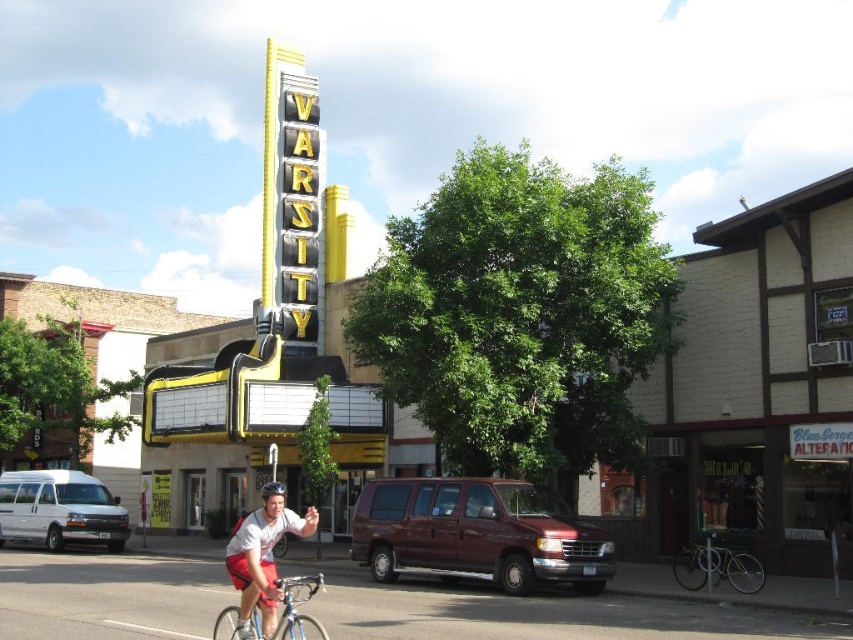
Is matte white helmet at center positioned before silver metallic bicycle at lower left?

No, matte white helmet at center is further to the viewer.

Who is higher up, matte white helmet at center or silver metallic bicycle at lower left?

Positioned higher is matte white helmet at center.

Between point (247, 566) and point (233, 634), which one is positioned in front?

Point (247, 566) is more forward.

This screenshot has height=640, width=853. I want to click on matte white helmet at center, so 262,557.

Is maroon matte van at center smaller than matte white helmet at center?

Yes, maroon matte van at center is smaller than matte white helmet at center.

Is point (514, 550) farther from viewer compared to point (273, 609)?

That is True.

Describe the element at coordinates (476, 532) in the screenshot. I see `maroon matte van at center` at that location.

This screenshot has width=853, height=640. What are the coordinates of `maroon matte van at center` in the screenshot? It's located at (476, 532).

Which is above, maroon matte van at center or shiny silver bicycle at lower right?

Positioned higher is maroon matte van at center.

Between maroon matte van at center and shiny silver bicycle at lower right, which one appears on the left side from the viewer's perspective?

maroon matte van at center is more to the left.

Where is `maroon matte van at center`? maroon matte van at center is located at coordinates (476, 532).